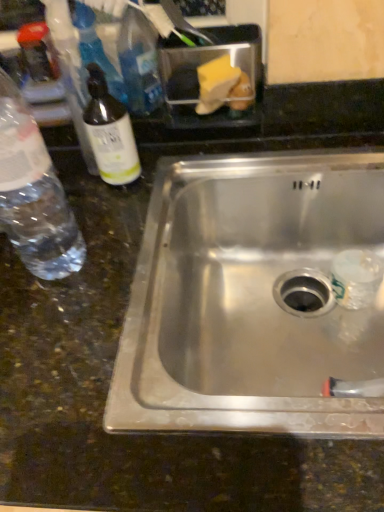
Image resolution: width=384 pixels, height=512 pixels. In order to click on clear plastic bottle at left, the first bottle when ordered from left to right in this screenshot , I will do `click(34, 194)`.

This screenshot has height=512, width=384. In order to click on stainless steel sink at center in this screenshot , I will do `click(251, 298)`.

Locate an element on the screen. This screenshot has width=384, height=512. clear plastic bottle at left, the first bottle when ordered from left to right is located at coordinates (34, 194).

In the image, is clear plastic bottle at left, which is the second bottle in right-to-left order, on the left side or the right side of clear glass bottle at left, which is the 1th bottle in right-to-left order?

Based on their positions, clear plastic bottle at left, which is the second bottle in right-to-left order, is located to the left of clear glass bottle at left, which is the 1th bottle in right-to-left order.

Does point (15, 136) come in front of point (97, 115)?

Yes.

From a real-world perspective, which is physically above, clear plastic bottle at left, the first bottle when ordered from left to right, or clear glass bottle at left, acting as the second bottle starting from the left?

From a 3D spatial view, clear plastic bottle at left, the first bottle when ordered from left to right, is above.

Is clear plastic bottle at left, which is the second bottle in right-to-left order, far from clear glass bottle at left, which is the 1th bottle in right-to-left order?

Actually, clear plastic bottle at left, which is the second bottle in right-to-left order, and clear glass bottle at left, which is the 1th bottle in right-to-left order, are a little close together.

Based on the photo, which object is wider, stainless steel sink at center or clear glass bottle at left, which is the 1th bottle in right-to-left order?

stainless steel sink at center.

Between stainless steel sink at center and clear glass bottle at left, which is the 1th bottle in right-to-left order, which one has smaller size?

Smaller between the two is clear glass bottle at left, which is the 1th bottle in right-to-left order.

Considering the sizes of stainless steel sink at center and clear glass bottle at left, acting as the second bottle starting from the left, in the image, is stainless steel sink at center taller or shorter than clear glass bottle at left, acting as the second bottle starting from the left,?

Considering their sizes, stainless steel sink at center has more height than clear glass bottle at left, acting as the second bottle starting from the left.

Considering the positions of point (143, 385) and point (89, 68), is point (143, 385) closer or farther from the camera than point (89, 68)?

Clearly, point (143, 385) is closer to the camera than point (89, 68).

Does point (339, 200) come in front of point (42, 192)?

No, (339, 200) is further to viewer.

Are stainless steel sink at center and clear plastic bottle at left, the first bottle when ordered from left to right, located far from each other?

stainless steel sink at center is actually quite close to clear plastic bottle at left, the first bottle when ordered from left to right.

From a real-world perspective, which is physically above, stainless steel sink at center or clear plastic bottle at left, which is the second bottle in right-to-left order?

clear plastic bottle at left, which is the second bottle in right-to-left order.

Is stainless steel sink at center not within clear plastic bottle at left, which is the second bottle in right-to-left order?

Absolutely, stainless steel sink at center is external to clear plastic bottle at left, which is the second bottle in right-to-left order.

Considering the relative sizes of clear glass bottle at left, which is the 1th bottle in right-to-left order, and clear plastic bottle at left, the first bottle when ordered from left to right, in the image provided, is clear glass bottle at left, which is the 1th bottle in right-to-left order, smaller than clear plastic bottle at left, the first bottle when ordered from left to right,?

Yes.

Could you measure the distance between clear glass bottle at left, acting as the second bottle starting from the left, and clear plastic bottle at left, which is the second bottle in right-to-left order?

clear glass bottle at left, acting as the second bottle starting from the left, and clear plastic bottle at left, which is the second bottle in right-to-left order, are 5.76 inches apart from each other.

Does clear glass bottle at left, acting as the second bottle starting from the left, turn towards clear plastic bottle at left, which is the second bottle in right-to-left order?

Yes, clear glass bottle at left, acting as the second bottle starting from the left, faces towards clear plastic bottle at left, which is the second bottle in right-to-left order.

How different are the orientations of clear glass bottle at left, acting as the second bottle starting from the left, and clear plastic bottle at left, which is the second bottle in right-to-left order, in degrees?

They differ by 0.000214 degrees in their facing directions.

Is stainless steel sink at center at the back of clear plastic bottle at left, the first bottle when ordered from left to right?

clear plastic bottle at left, the first bottle when ordered from left to right, does not have its back to stainless steel sink at center.

From a real-world perspective, which is physically below, clear plastic bottle at left, the first bottle when ordered from left to right, or stainless steel sink at center?

stainless steel sink at center.

Is clear plastic bottle at left, which is the second bottle in right-to-left order, situated inside stainless steel sink at center or outside?

clear plastic bottle at left, which is the second bottle in right-to-left order, is located beyond the bounds of stainless steel sink at center.

Does point (128, 182) come behind point (285, 202)?

No, it is in front of (285, 202).

What's the angular difference between clear glass bottle at left, acting as the second bottle starting from the left, and stainless steel sink at center's facing directions?

They differ by 0.000116 degrees in their facing directions.

Which object is positioned more to the right, clear glass bottle at left, acting as the second bottle starting from the left, or stainless steel sink at center?

stainless steel sink at center is more to the right.

Who is shorter, clear glass bottle at left, which is the 1th bottle in right-to-left order, or stainless steel sink at center?

Standing shorter between the two is clear glass bottle at left, which is the 1th bottle in right-to-left order.

Find the location of a particular element. bottle that appears behind the clear plastic bottle at left, the first bottle when ordered from left to right is located at coordinates (110, 132).

The image size is (384, 512). What are the coordinates of `sink below the clear glass bottle at left, which is the 1th bottle in right-to-left order (from the image's perspective)` in the screenshot? It's located at (251, 298).

When comparing their distances from stainless steel sink at center, does clear plastic bottle at left, which is the second bottle in right-to-left order, or clear glass bottle at left, acting as the second bottle starting from the left, seem closer?

clear glass bottle at left, acting as the second bottle starting from the left, is closer to stainless steel sink at center.

Looking at the image, which one is located further to clear plastic bottle at left, the first bottle when ordered from left to right, clear glass bottle at left, which is the 1th bottle in right-to-left order, or stainless steel sink at center?

Based on the image, stainless steel sink at center appears to be further to clear plastic bottle at left, the first bottle when ordered from left to right.

Which object lies further to the anchor point clear glass bottle at left, acting as the second bottle starting from the left, clear plastic bottle at left, the first bottle when ordered from left to right, or stainless steel sink at center?

stainless steel sink at center.

Which object lies nearer to the anchor point stainless steel sink at center, clear glass bottle at left, which is the 1th bottle in right-to-left order, or clear plastic bottle at left, the first bottle when ordered from left to right?

Answer: Among the two, clear glass bottle at left, which is the 1th bottle in right-to-left order, is located nearer to stainless steel sink at center.

Which object lies nearer to the anchor point clear glass bottle at left, acting as the second bottle starting from the left, stainless steel sink at center or clear plastic bottle at left, which is the second bottle in right-to-left order?

clear plastic bottle at left, which is the second bottle in right-to-left order, lies closer to clear glass bottle at left, acting as the second bottle starting from the left, than the other object.

Estimate the real-world distances between objects in this image. Which object is further from clear plastic bottle at left, which is the second bottle in right-to-left order, stainless steel sink at center or clear glass bottle at left, which is the 1th bottle in right-to-left order?

Among the two, stainless steel sink at center is located further to clear plastic bottle at left, which is the second bottle in right-to-left order.

I want to click on bottle between clear plastic bottle at left, which is the second bottle in right-to-left order, and stainless steel sink at center, in the horizontal direction, so click(110, 132).